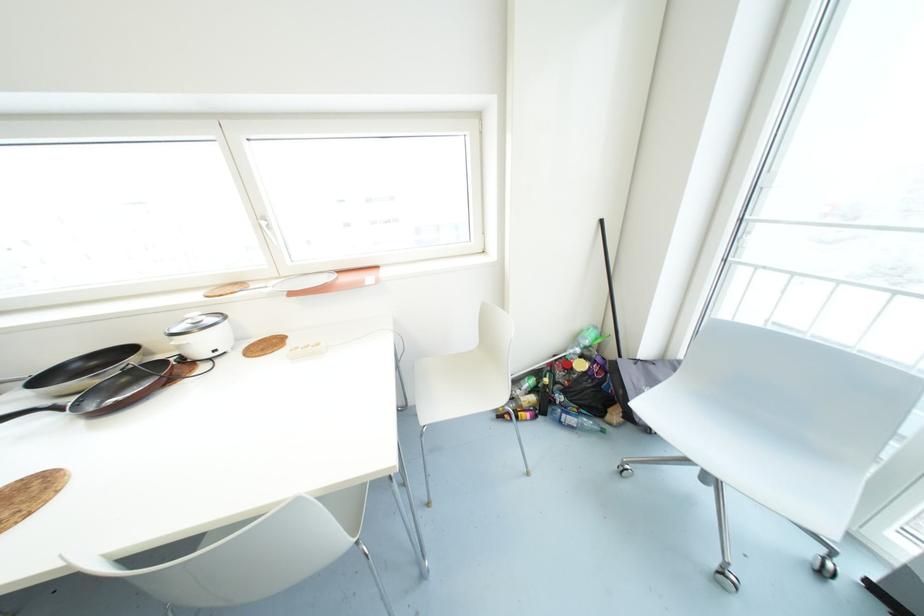
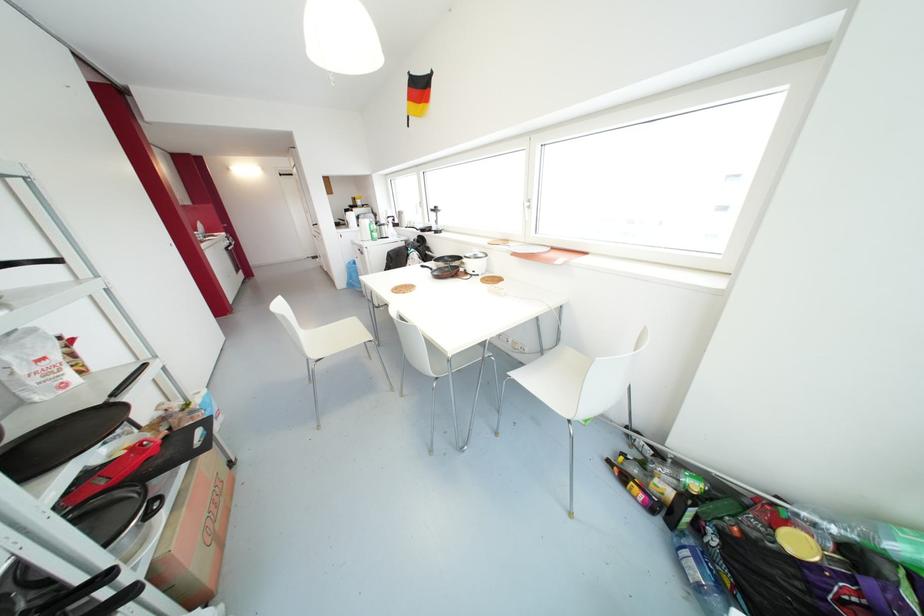
Where in the second image is the point corresponding to (520,405) from the first image?

(648, 484)